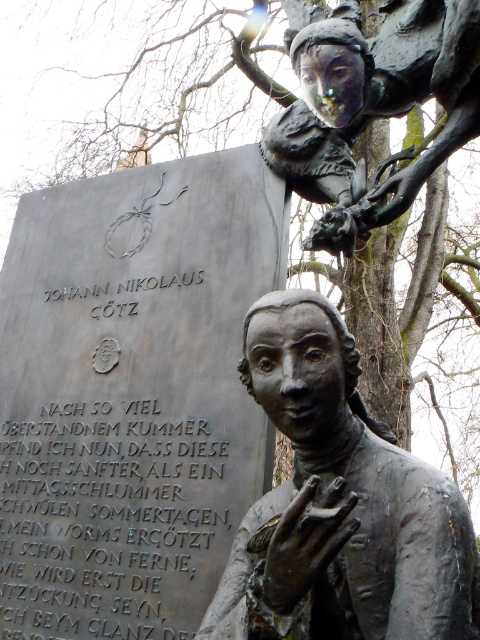
Question: Can you confirm if bronze statue at center is bigger than bronze statue at upper right?

Choices:
 (A) yes
 (B) no

Answer: (A)

Question: Does bronze statue at center lie behind bronze statue at upper right?

Choices:
 (A) yes
 (B) no

Answer: (B)

Question: Which point appears closest to the camera in this image?

Choices:
 (A) (310, 458)
 (B) (335, 246)

Answer: (A)

Question: Which point is farther from the camera taking this photo?

Choices:
 (A) (283, 124)
 (B) (396, 531)

Answer: (A)

Question: Which point is closer to the camera?

Choices:
 (A) (395, 506)
 (B) (415, 188)

Answer: (A)

Question: Is bronze statue at center bigger than bronze statue at upper right?

Choices:
 (A) no
 (B) yes

Answer: (B)